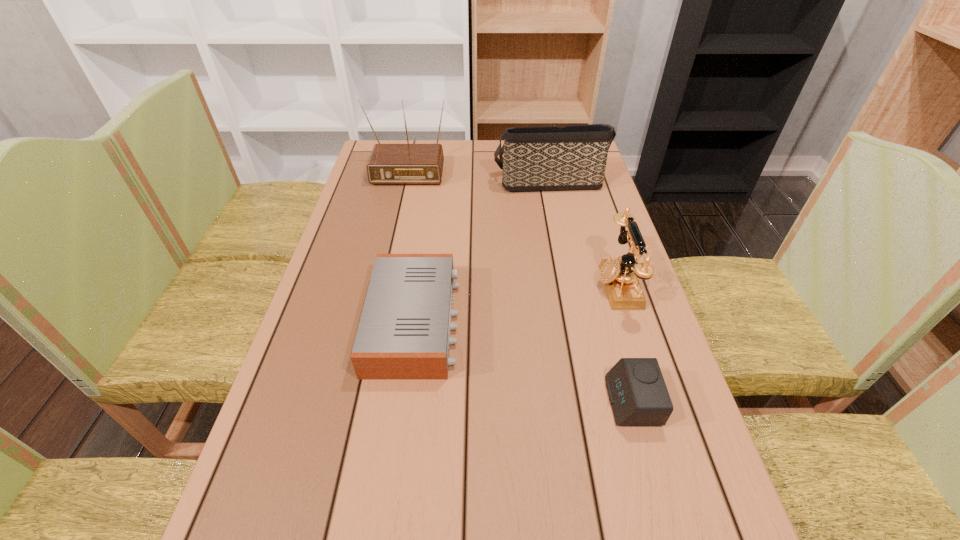
In order to click on vacant area that lies between the nearer radio receiver and the taller radio receiver in this screenshot , I will do `click(412, 243)`.

Image resolution: width=960 pixels, height=540 pixels. I want to click on free space between the nearer radio receiver and the alarm clock, so click(523, 362).

Select which object appears as the fourth closest to the telephone. Please provide its 2D coordinates. Your answer should be formatted as a tuple, i.e. [(x, y)], where the tuple contains the x and y coordinates of a point satisfying the conditions above.

[(407, 163)]

Image resolution: width=960 pixels, height=540 pixels. In order to click on object that stands as the fourth closest to the shorter radio receiver in this screenshot , I will do `click(407, 163)`.